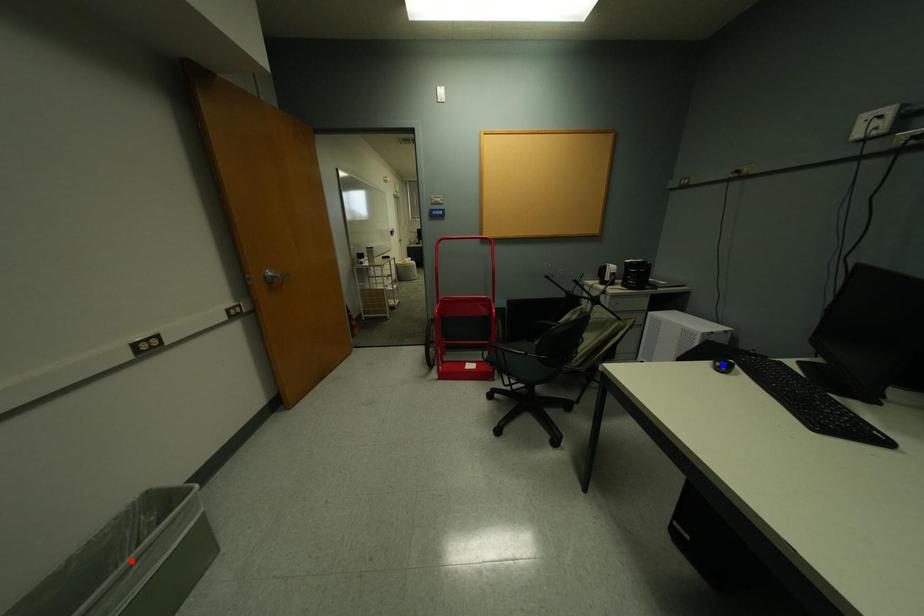
Question: In the image, two points are highlighted. Which point is nearer to the camera? Reply with the corresponding letter.

Choices:
 (A) blue point
 (B) red point

Answer: (B)